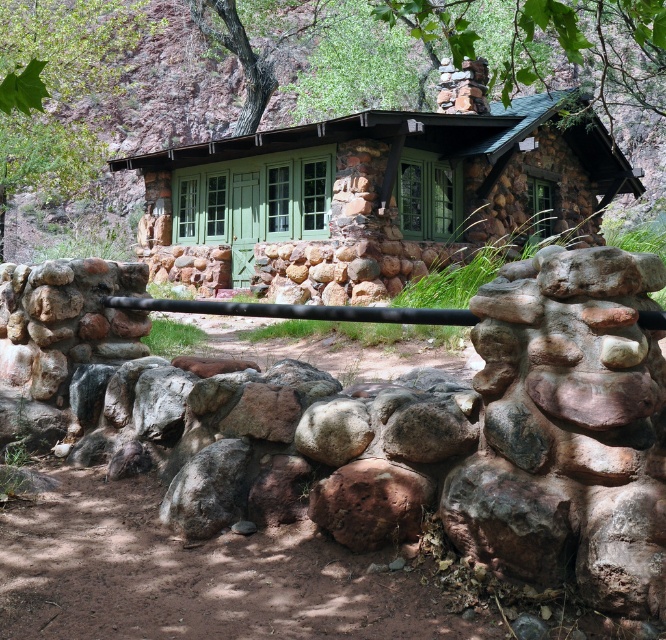
Question: Does green stone cabin at center have a lesser width compared to green stone chimney at upper center?

Choices:
 (A) yes
 (B) no

Answer: (B)

Question: Does green stone cabin at center appear over green stone chimney at upper center?

Choices:
 (A) yes
 (B) no

Answer: (B)

Question: Which point appears closest to the camera in this image?

Choices:
 (A) (593, 60)
 (B) (192, 236)

Answer: (B)

Question: Can you confirm if green stone cabin at center is wider than green stone chimney at upper center?

Choices:
 (A) yes
 (B) no

Answer: (A)